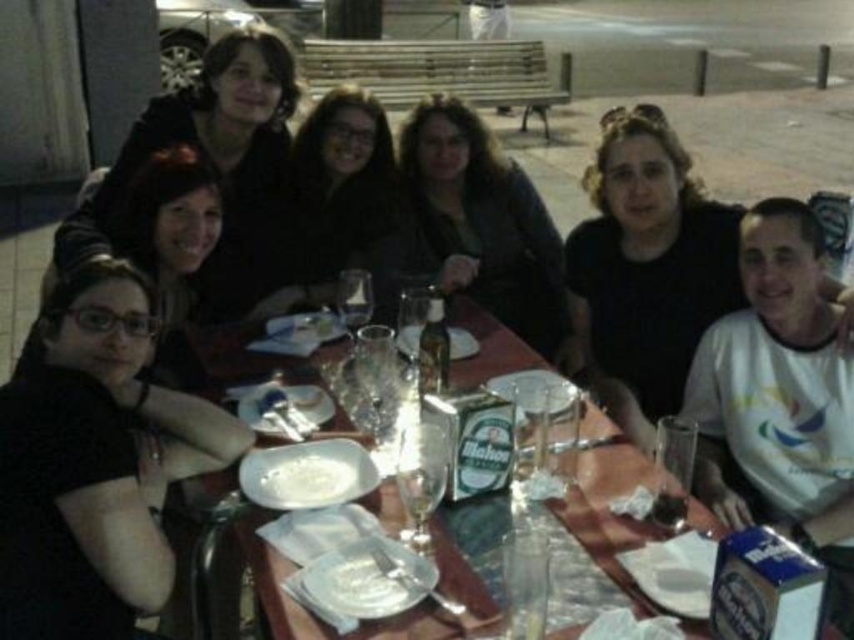
You are standing at the center of the table and want to hand a napkin to the person wearing the black matte shirt at lower left. In which direction should you move to reach them?

The black matte shirt at lower left is located at point (95, 465), so you should move towards the lower left direction to reach them.

You are a photographer holding a camera and want to take a picture of the black matte shirt at lower left without moving the shirt. Can you do it from your current position?

The black matte shirt at lower left and camera are 1.36 meters apart from each other, so yes, you can take a picture of the black matte shirt at lower left from your current position since the distance is manageable for photography.